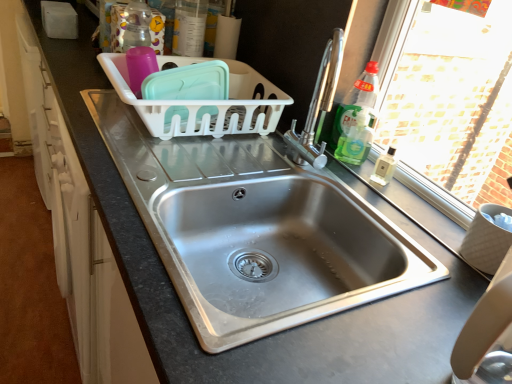
Identify the location of translucent plastic container at upper center, the 1th bottle in the top-to-bottom sequence. (189, 27).

Describe the element at coordinates (205, 104) in the screenshot. The image size is (512, 384). I see `white plastic basket at center` at that location.

At what (x,y) coordinates should I click in order to perform the action: click on white plastic basket at center. Please return your answer as a coordinate pair (x, y). This screenshot has height=384, width=512. Looking at the image, I should click on (205, 104).

This screenshot has height=384, width=512. What do you see at coordinates (255, 230) in the screenshot?
I see `stainless steel sink at center, the second sink in the top-to-bottom sequence` at bounding box center [255, 230].

I want to click on stainless steel sink at center, the first sink from the top, so click(276, 243).

The width and height of the screenshot is (512, 384). Identify the location of green translucent soap dispenser at right, the 1th bottle positioned from the right. (356, 139).

Considering the sizes of objects stainless steel sink at center, positioned as the 2th sink in bottom-to-top order, and stainless steel sink at center, the second sink in the top-to-bottom sequence, in the image provided, who is wider, stainless steel sink at center, positioned as the 2th sink in bottom-to-top order, or stainless steel sink at center, the second sink in the top-to-bottom sequence,?

Wider between the two is stainless steel sink at center, the second sink in the top-to-bottom sequence.

The width and height of the screenshot is (512, 384). In order to click on sink to the left of stainless steel sink at center, positioned as the 2th sink in bottom-to-top order in this screenshot , I will do `click(255, 230)`.

From a real-world perspective, is green glass bottle at upper right, which ranks as the 2th bottle in bottom-to-top order, on green translucent soap dispenser at right, acting as the first bottle starting from the bottom?

Indeed, from a real-world perspective, green glass bottle at upper right, which ranks as the 2th bottle in bottom-to-top order, stands above green translucent soap dispenser at right, acting as the first bottle starting from the bottom.

Consider the image. Is green translucent soap dispenser at right, which is the 3th bottle from left to right, located within green glass bottle at upper right, which ranks as the 2th bottle in bottom-to-top order?

No, green translucent soap dispenser at right, which is the 3th bottle from left to right, is not surrounded by green glass bottle at upper right, which ranks as the 2th bottle in bottom-to-top order.

Is point (337, 143) positioned behind point (364, 140)?

That is True.

In the scene shown: Can you tell me how much green glass bottle at upper right, marked as the second bottle in a top-to-bottom arrangement, and green translucent soap dispenser at right, the 1th bottle positioned from the right, differ in facing direction?

The facing directions of green glass bottle at upper right, marked as the second bottle in a top-to-bottom arrangement, and green translucent soap dispenser at right, the 1th bottle positioned from the right, are 27.3 degrees apart.

How much distance is there between green translucent soap dispenser at right, the 1th bottle positioned from the right, and green glass bottle at upper right, which ranks as the 2th bottle in bottom-to-top order?

green translucent soap dispenser at right, the 1th bottle positioned from the right, is 0.90 inches away from green glass bottle at upper right, which ranks as the 2th bottle in bottom-to-top order.

Could you tell me if green translucent soap dispenser at right, which is counted as the 3th bottle, starting from the top, is turned towards green glass bottle at upper right, the 2th bottle when ordered from left to right?

No.

Are green translucent soap dispenser at right, which is counted as the 3th bottle, starting from the top, and green glass bottle at upper right, which ranks as the 2th bottle in bottom-to-top order, making contact?

Yes, green translucent soap dispenser at right, which is counted as the 3th bottle, starting from the top, is beside green glass bottle at upper right, which ranks as the 2th bottle in bottom-to-top order.

Where is `bottle that is the 1st object located behind the green glass bottle at upper right, which is counted as the 2th bottle, starting from the right`? bottle that is the 1st object located behind the green glass bottle at upper right, which is counted as the 2th bottle, starting from the right is located at coordinates (356, 139).

Looking at this image, from the image's perspective, between translucent plastic container at upper center, the 3th bottle when ordered from bottom to top, and stainless steel sink at center, the first sink from the top, which one is located above?

translucent plastic container at upper center, the 3th bottle when ordered from bottom to top.

From a real-world perspective, who is located lower, translucent plastic container at upper center, arranged as the third bottle when viewed from the right, or stainless steel sink at center, the first sink from the top?

From a 3D spatial view, stainless steel sink at center, the first sink from the top, is below.

Image resolution: width=512 pixels, height=384 pixels. Find the location of `the 1st sink below the translucent plastic container at upper center, the 1th bottle in the top-to-bottom sequence (from the image's perspective)`. the 1st sink below the translucent plastic container at upper center, the 1th bottle in the top-to-bottom sequence (from the image's perspective) is located at coordinates (276, 243).

Can you confirm if translucent plastic container at upper center, the 1th bottle in the top-to-bottom sequence, is positioned to the left of stainless steel sink at center, positioned as the 2th sink in bottom-to-top order?

Correct, you'll find translucent plastic container at upper center, the 1th bottle in the top-to-bottom sequence, to the left of stainless steel sink at center, positioned as the 2th sink in bottom-to-top order.

Who is smaller, white plastic basket at center or translucent plastic container at upper center, the 1th bottle in the top-to-bottom sequence?

translucent plastic container at upper center, the 1th bottle in the top-to-bottom sequence, is smaller.

Who is shorter, white plastic basket at center or translucent plastic container at upper center, the 3th bottle when ordered from bottom to top?

white plastic basket at center.

Choose the correct answer: Is white plastic basket at center inside translucent plastic container at upper center, the 1th bottle in the top-to-bottom sequence, or outside it?

white plastic basket at center is located beyond the bounds of translucent plastic container at upper center, the 1th bottle in the top-to-bottom sequence.

Which is closer, (347, 140) or (321, 267)?

Point (347, 140) is positioned farther from the camera compared to point (321, 267).

Does green glass bottle at upper right, marked as the second bottle in a top-to-bottom arrangement, touch stainless steel sink at center, positioned as the 2th sink in bottom-to-top order?

No, green glass bottle at upper right, marked as the second bottle in a top-to-bottom arrangement, is not next to stainless steel sink at center, positioned as the 2th sink in bottom-to-top order.

Between green glass bottle at upper right, the 2th bottle when ordered from left to right, and stainless steel sink at center, the first sink from the top, which one appears on the right side from the viewer's perspective?

green glass bottle at upper right, the 2th bottle when ordered from left to right.

Is green glass bottle at upper right, marked as the second bottle in a top-to-bottom arrangement, located outside stainless steel sink at center, the first sink from the top?

green glass bottle at upper right, marked as the second bottle in a top-to-bottom arrangement, lies outside stainless steel sink at center, the first sink from the top,'s area.

From a real-world perspective, is green translucent soap dispenser at right, acting as the first bottle starting from the bottom, physically located above or below translucent plastic container at upper center, which appears as the 1th bottle when viewed from the left?

green translucent soap dispenser at right, acting as the first bottle starting from the bottom, is situated lower than translucent plastic container at upper center, which appears as the 1th bottle when viewed from the left, in the real world.

How much distance is there between green translucent soap dispenser at right, the 1th bottle positioned from the right, and translucent plastic container at upper center, arranged as the third bottle when viewed from the right?

They are 25.03 inches apart.

Is point (361, 162) closer to camera compared to point (181, 10)?

Yes, it is.

Between green translucent soap dispenser at right, acting as the first bottle starting from the bottom, and translucent plastic container at upper center, which appears as the 1th bottle when viewed from the left, which one is positioned in front?

green translucent soap dispenser at right, acting as the first bottle starting from the bottom, is more forward.

Where is `sink on the right of the stainless steel sink at center, the first sink in the bottom-to-top sequence`? sink on the right of the stainless steel sink at center, the first sink in the bottom-to-top sequence is located at coordinates (276, 243).

Find the location of `bottle that appears below the green glass bottle at upper right, which is counted as the 2th bottle, starting from the right (from a real-world perspective)`. bottle that appears below the green glass bottle at upper right, which is counted as the 2th bottle, starting from the right (from a real-world perspective) is located at coordinates (356, 139).

Estimate the real-world distances between objects in this image. Which object is closer to green glass bottle at upper right, which ranks as the 2th bottle in bottom-to-top order, white plastic basket at center or stainless steel sink at center, the second sink in the top-to-bottom sequence?

Among the two, white plastic basket at center is located nearer to green glass bottle at upper right, which ranks as the 2th bottle in bottom-to-top order.

Considering their positions, is green glass bottle at upper right, the 2th bottle when ordered from left to right, positioned further to white plastic basket at center than stainless steel sink at center, the first sink from the top?

stainless steel sink at center, the first sink from the top.

Based on their spatial positions, is stainless steel sink at center, the first sink from the top, or green glass bottle at upper right, marked as the second bottle in a top-to-bottom arrangement, closer to white plastic basket at center?

green glass bottle at upper right, marked as the second bottle in a top-to-bottom arrangement, lies closer to white plastic basket at center than the other object.

From the image, which object appears to be nearer to green glass bottle at upper right, which ranks as the 2th bottle in bottom-to-top order, stainless steel sink at center, the second sink in the top-to-bottom sequence, or stainless steel sink at center, positioned as the 2th sink in bottom-to-top order?

Among the two, stainless steel sink at center, positioned as the 2th sink in bottom-to-top order, is located nearer to green glass bottle at upper right, which ranks as the 2th bottle in bottom-to-top order.

When comparing their distances from stainless steel sink at center, the first sink from the top, does translucent plastic container at upper center, the 3th bottle when ordered from bottom to top, or stainless steel sink at center, the second sink in the top-to-bottom sequence, seem further?

Among the two, translucent plastic container at upper center, the 3th bottle when ordered from bottom to top, is located further to stainless steel sink at center, the first sink from the top.

Based on their spatial positions, is green glass bottle at upper right, which ranks as the 2th bottle in bottom-to-top order, or white plastic basket at center further from stainless steel sink at center, the first sink from the top?

Based on the image, white plastic basket at center appears to be further to stainless steel sink at center, the first sink from the top.

From the image, which object appears to be farther from translucent plastic container at upper center, arranged as the third bottle when viewed from the right, stainless steel sink at center, positioned as the 2th sink in bottom-to-top order, or stainless steel sink at center, the first sink in the bottom-to-top sequence?

stainless steel sink at center, positioned as the 2th sink in bottom-to-top order, lies further to translucent plastic container at upper center, arranged as the third bottle when viewed from the right, than the other object.

Looking at the image, which one is located further to green translucent soap dispenser at right, which is counted as the 3th bottle, starting from the top, white plastic basket at center or translucent plastic container at upper center, which appears as the 1th bottle when viewed from the left?

translucent plastic container at upper center, which appears as the 1th bottle when viewed from the left.

Image resolution: width=512 pixels, height=384 pixels. In order to click on basket between translucent plastic container at upper center, which appears as the 1th bottle when viewed from the left, and stainless steel sink at center, the second sink in the top-to-bottom sequence, vertically in this screenshot , I will do `click(205, 104)`.

Where is `sink between white plastic basket at center and stainless steel sink at center, the second sink in the top-to-bottom sequence, from top to bottom`? The width and height of the screenshot is (512, 384). sink between white plastic basket at center and stainless steel sink at center, the second sink in the top-to-bottom sequence, from top to bottom is located at coordinates (276, 243).

Locate an element on the screen. The image size is (512, 384). bottle between stainless steel sink at center, the first sink from the top, and green translucent soap dispenser at right, which is counted as the 3th bottle, starting from the top, in the front-back direction is located at coordinates (355, 118).

The width and height of the screenshot is (512, 384). I want to click on basket between translucent plastic container at upper center, arranged as the third bottle when viewed from the right, and green translucent soap dispenser at right, acting as the first bottle starting from the bottom, in the horizontal direction, so click(x=205, y=104).